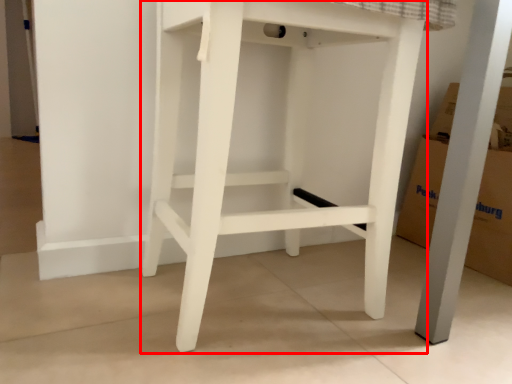
Question: From the image's perspective, what is the correct spatial positioning of furniture (annotated by the red box) in reference to cardboard box?

Choices:
 (A) below
 (B) above

Answer: (B)